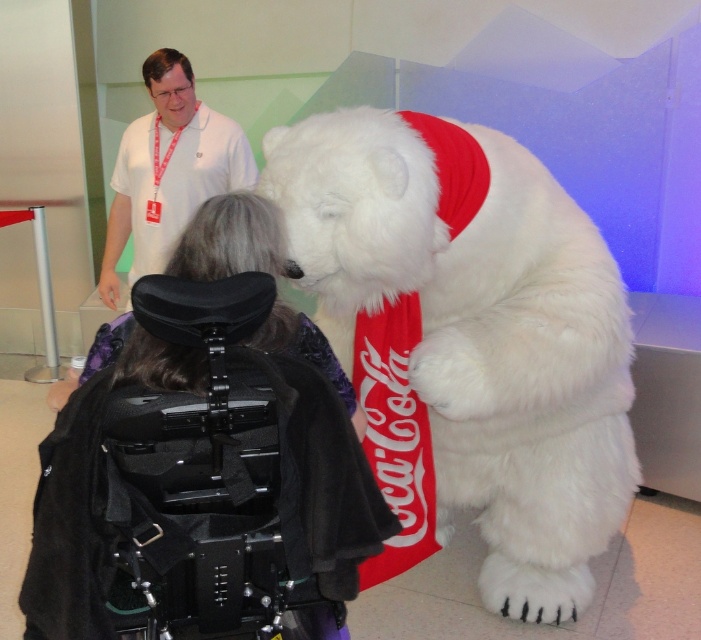
Question: Which is nearer to the dark purple fabric at center?

Choices:
 (A) white cotton shirt at upper left
 (B) white fluffy bear at center

Answer: (B)

Question: In this image, where is white fluffy bear at center located relative to white cotton shirt at upper left?

Choices:
 (A) left
 (B) right

Answer: (B)

Question: Is white fluffy bear at center positioned at the back of white cotton shirt at upper left?

Choices:
 (A) yes
 (B) no

Answer: (B)

Question: Which object is farther from the camera taking this photo?

Choices:
 (A) white cotton shirt at upper left
 (B) dark purple fabric at center

Answer: (A)

Question: Does dark purple fabric at center have a lesser width compared to white cotton shirt at upper left?

Choices:
 (A) no
 (B) yes

Answer: (A)

Question: Which point is closer to the camera?

Choices:
 (A) dark purple fabric at center
 (B) white cotton shirt at upper left

Answer: (A)